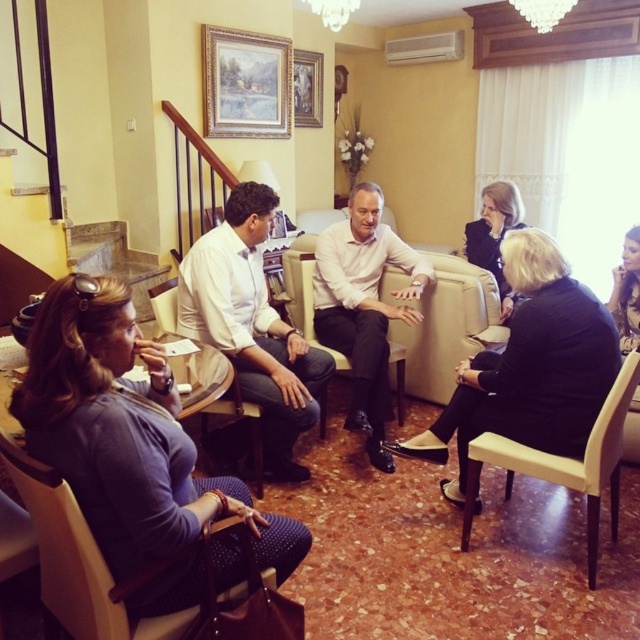
You are a person who is 5 feet tall and want to place a 2.5 feet wide decorative item between the matte black chair at lower left and the smooth black dress at lower right. Will there be enough space between them to place the item?

The distance between the matte black chair at lower left and the smooth black dress at lower right is 3.46 feet. Since the decorative item is 2.5 feet wide, there is enough space to place it between them as 3.46 feet is greater than 2.5 feet.

You are a photographer setting up for a group photo. You need to position yourself so that both the matte black chair at lower left and the smooth black dress at lower right are in frame. Based on their positions, which object should you place closer to the left edge of your camera viewfinder?

The matte black chair at lower left should be placed closer to the left edge of the camera viewfinder since it is positioned on the left side of the smooth black dress at lower right.